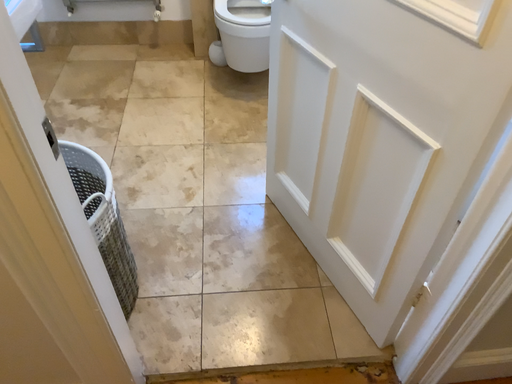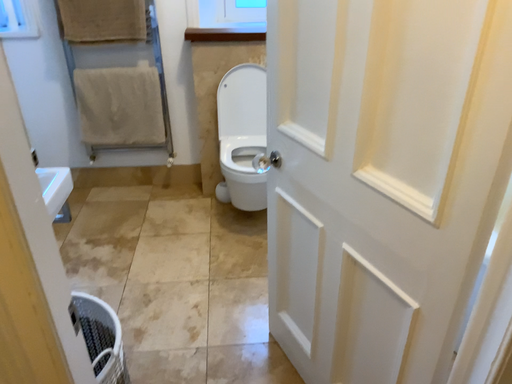
Question: Which way did the camera rotate in the video?

Choices:
 (A) rotated upward
 (B) rotated downward

Answer: (A)